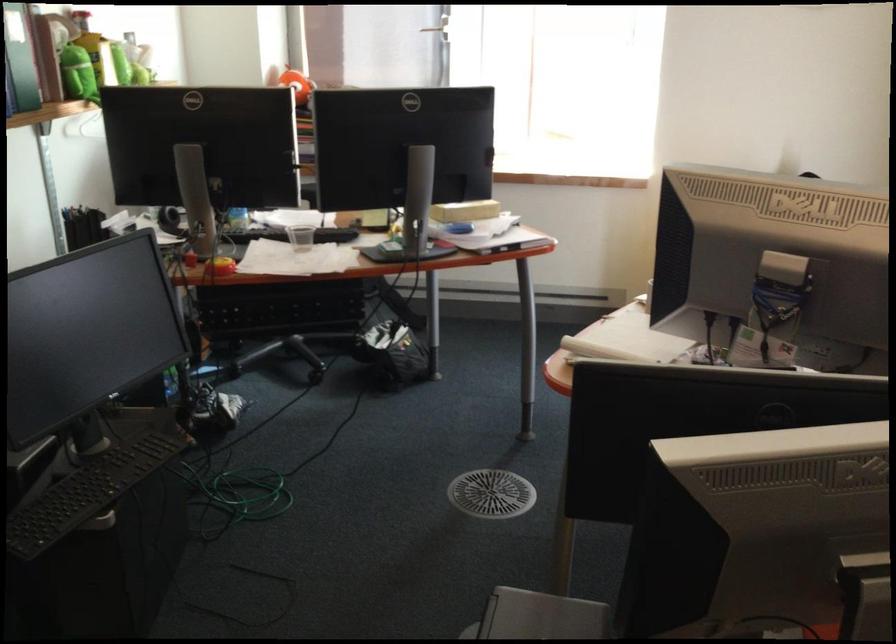
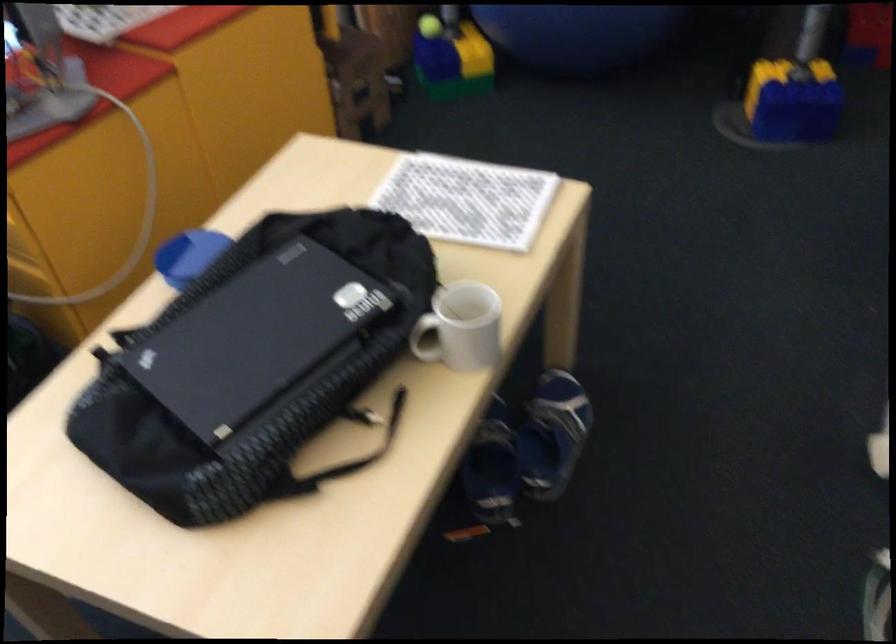
First-person continuous shooting, in which direction is the camera rotating?

The camera's rotation is toward right-down.